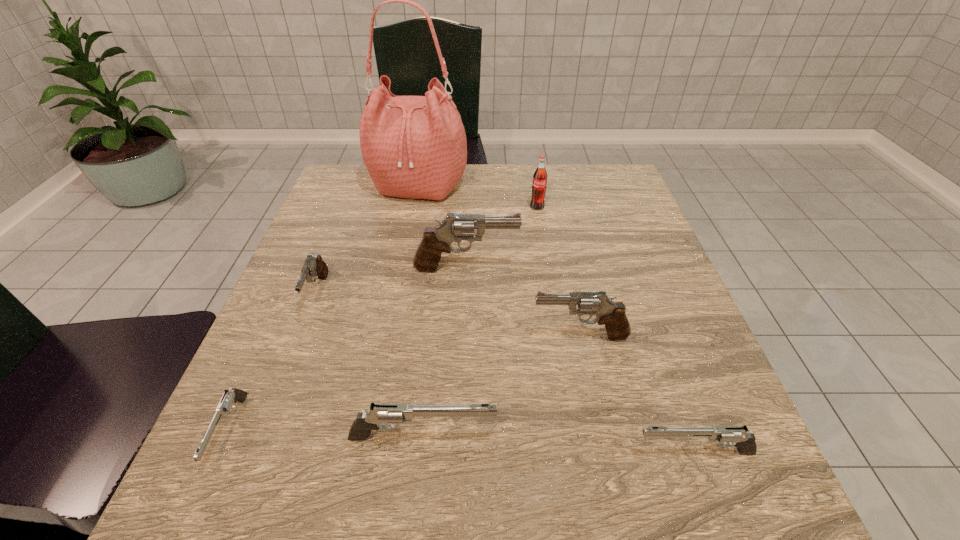
Find the location of a particular element. The width and height of the screenshot is (960, 540). vacant space at the far edge is located at coordinates (511, 188).

Identify the location of free space at the left edge. This screenshot has height=540, width=960. (249, 393).

Locate an element on the screen. Image resolution: width=960 pixels, height=540 pixels. vacant area at the right edge is located at coordinates (724, 449).

Find the location of a particular element. vacant space at the far left corner of the desktop is located at coordinates (338, 204).

Where is `free space at the near left corner of the desktop`? This screenshot has height=540, width=960. free space at the near left corner of the desktop is located at coordinates tap(261, 475).

At what (x,y) coordinates should I click in order to perform the action: click on vacant space at the far right corner of the desktop. Please return your answer as a coordinate pair (x, y). Image resolution: width=960 pixels, height=540 pixels. Looking at the image, I should click on (619, 174).

This screenshot has height=540, width=960. Identify the location of free space between the handbag and the second pistol from left to right. (368, 239).

Where is `free spot between the smallest gray pistol and the tallest pistol`? The height and width of the screenshot is (540, 960). free spot between the smallest gray pistol and the tallest pistol is located at coordinates (392, 280).

Identify the location of free spot between the smallest silver pistol and the rightmost gray pistol. This screenshot has width=960, height=540. (404, 383).

The width and height of the screenshot is (960, 540). I want to click on blank region between the fifth pistol from right to left and the leftmost object, so click(x=274, y=362).